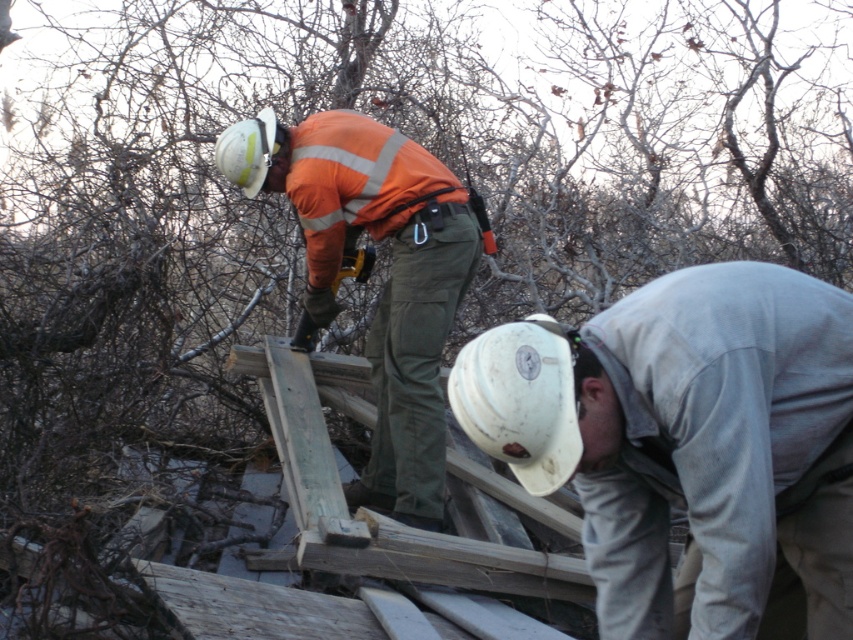
Question: Is white matte hard hat at lower center closer to the viewer compared to orange reflective jacket at center?

Choices:
 (A) yes
 (B) no

Answer: (A)

Question: Which of the following is the farthest from the observer?

Choices:
 (A) white matte hard hat at lower center
 (B) orange reflective jacket at center

Answer: (B)

Question: Which of the following is the closest to the observer?

Choices:
 (A) (381, 392)
 (B) (648, 352)

Answer: (B)

Question: Is white matte hard hat at lower center to the left of orange reflective jacket at center from the viewer's perspective?

Choices:
 (A) yes
 (B) no

Answer: (B)

Question: Can you confirm if white matte hard hat at lower center is wider than orange reflective jacket at center?

Choices:
 (A) yes
 (B) no

Answer: (B)